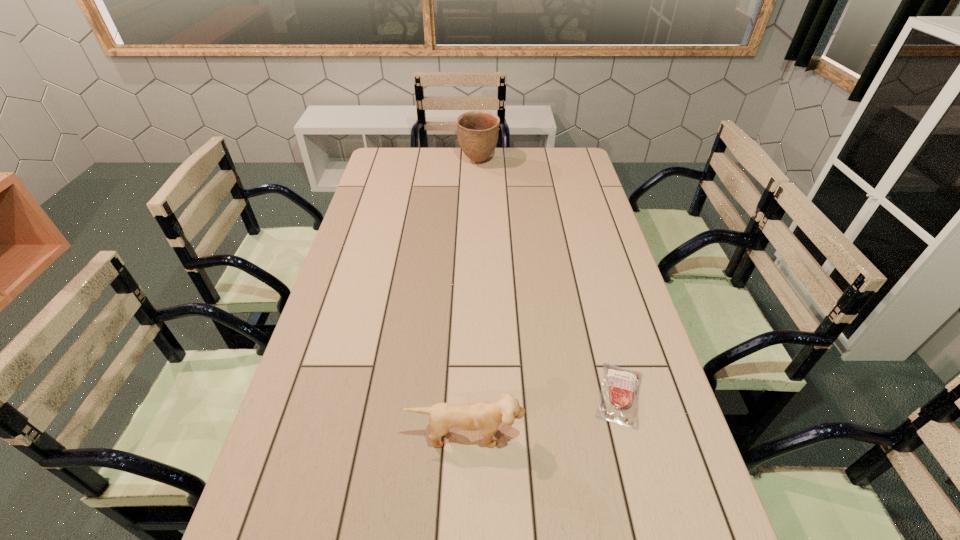
In order to click on the tallest object in this screenshot , I will do `click(477, 131)`.

This screenshot has width=960, height=540. I want to click on the farthest object, so click(477, 131).

What are the coordinates of `the second tallest object` in the screenshot? It's located at (486, 416).

I want to click on the rightmost object, so click(x=618, y=402).

Where is `steak`? This screenshot has height=540, width=960. steak is located at coordinates (618, 402).

In order to click on vacant region located 0.300m on the right of the farthest object in this screenshot , I will do `click(566, 161)`.

What are the coordinates of `vacant space located 0.150m on the left side of the second shortest object` in the screenshot? It's located at [x=464, y=523].

The height and width of the screenshot is (540, 960). In order to click on free space located on the back of the rightmost object in this screenshot , I will do `click(591, 289)`.

You are a GUI agent. You are given a task and a screenshot of the screen. Output one action in this format:
    pyautogui.click(x=<x>, y=<y>)
    Task: Click on the object present at the far edge
    The height and width of the screenshot is (540, 960).
    Given the screenshot: What is the action you would take?
    pyautogui.click(x=477, y=131)

At what (x,y) coordinates should I click in order to perform the action: click on object present at the right edge. Please return your answer as a coordinate pair (x, y). The image size is (960, 540). Looking at the image, I should click on (618, 402).